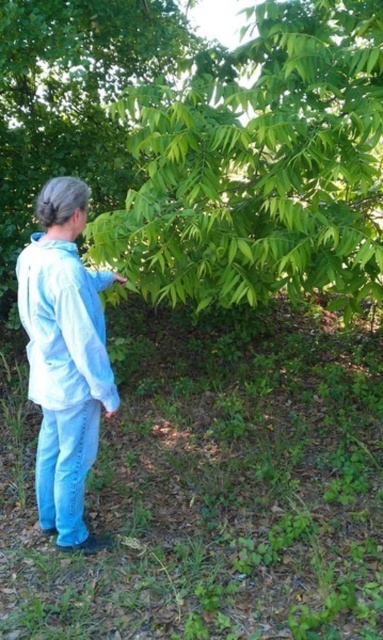
You are a photographer trying to capture the green leafy tree at center and the light blue denim pants at lower left in a single frame. Based on their positions, will the tree appear larger or smaller in the photo compared to the pants?

The green leafy tree at center is positioned over light blue denim pants at lower left, so the tree will appear larger in the photo compared to the pants because it is closer to the camera.

Based on the scene, which object is wider, the green leafy tree at center or the light blue denim pants at lower left?

The green leafy tree at center is wider than the light blue denim pants at lower left according to the description.

You are a hiker who wants to take a photo of the green leafy tree at center and the light blue denim pants at lower left in the same frame. Which object should you zoom in on to ensure both are visible?

You should zoom in on the light blue denim pants at lower left because the green leafy tree at center is larger in size than the light blue denim pants at lower left, so focusing on the smaller object allows both to fit in the frame.